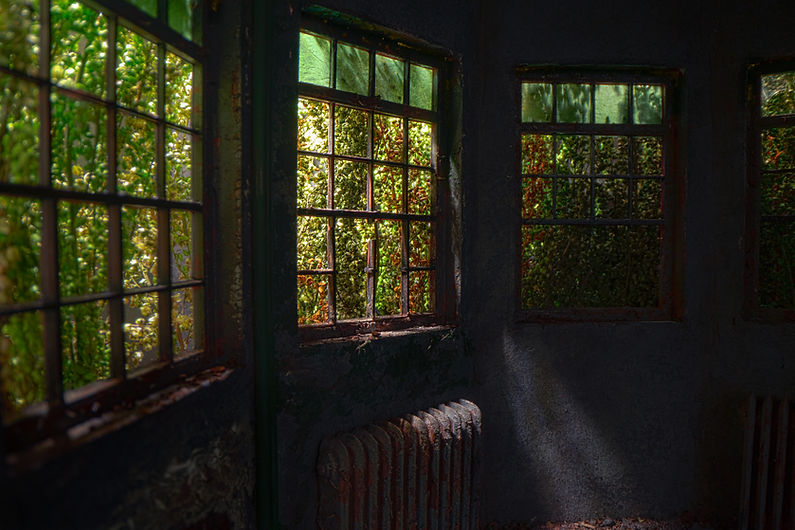
Find the location of `windows`. windows is located at coordinates (169, 208), (417, 189), (619, 190), (768, 194).